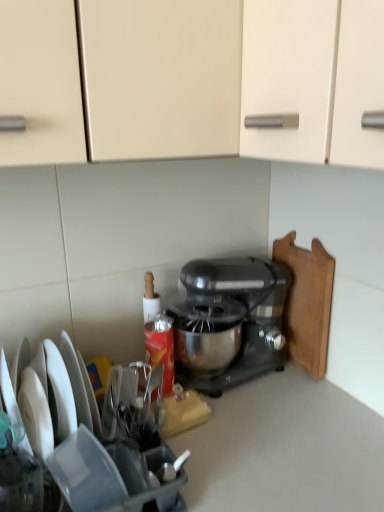
Question: Considering the positions of metallic silver mixer at center and satin black mixer at center in the image, is metallic silver mixer at center taller or shorter than satin black mixer at center?

Choices:
 (A) short
 (B) tall

Answer: (B)

Question: Looking at the image, does metallic silver mixer at center seem bigger or smaller compared to satin black mixer at center?

Choices:
 (A) small
 (B) big

Answer: (B)

Question: Estimate the real-world distances between objects in this image. Which object is closer to the metallic silver mixer at center?

Choices:
 (A) wooden cutting board at right
 (B) satin black mixer at center

Answer: (A)

Question: Based on their relative distances, which object is nearer to the wooden cutting board at right?

Choices:
 (A) satin black mixer at center
 (B) metallic silver mixer at center

Answer: (B)